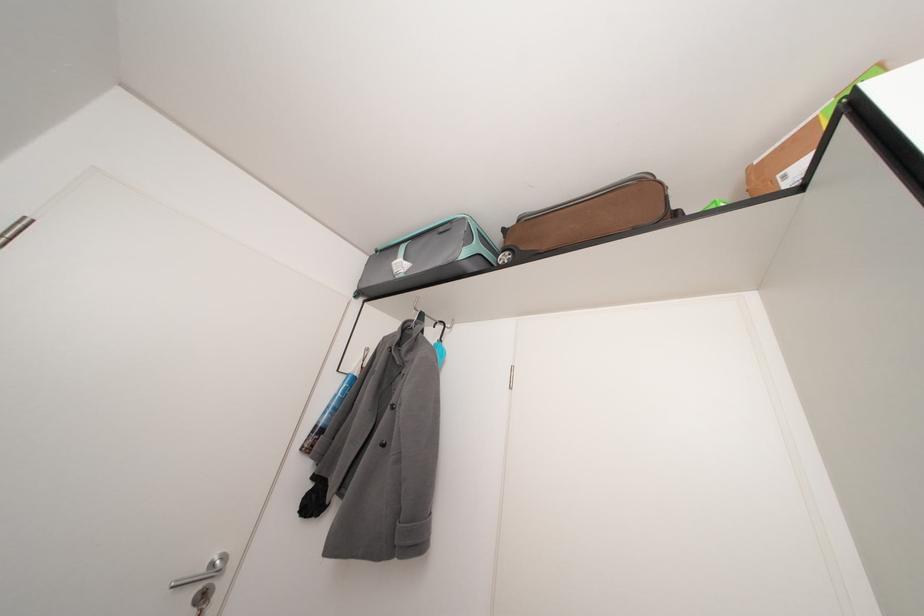
The width and height of the screenshot is (924, 616). What do you see at coordinates (2, 1) in the screenshot?
I see `a brown zippered case` at bounding box center [2, 1].